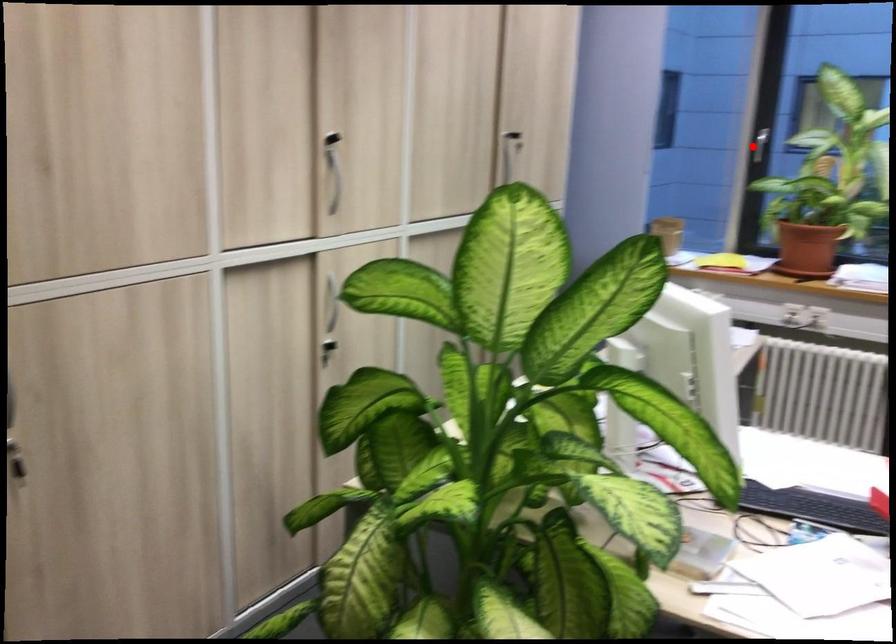
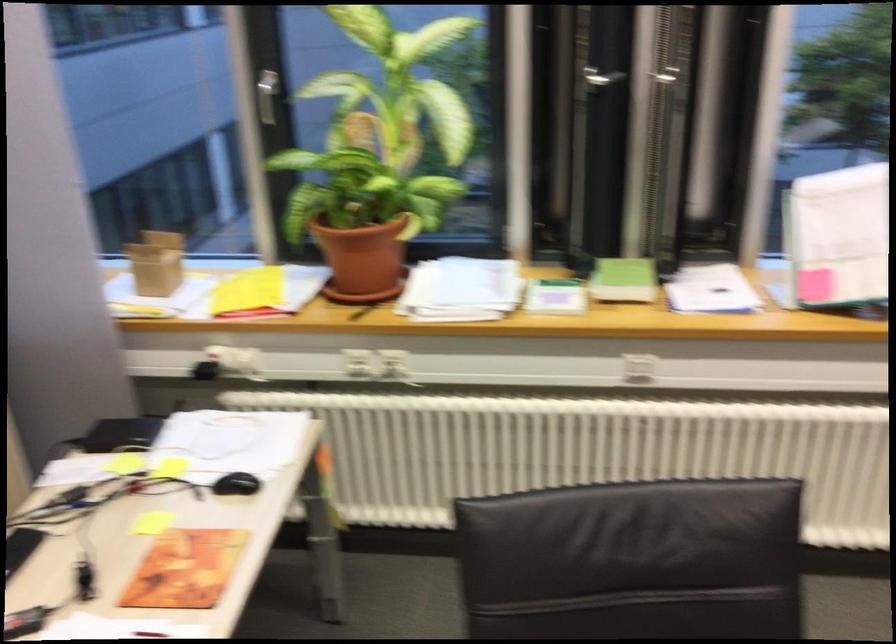
Question: I am providing you with two images of the same scene from different viewpoints. In image1, a red point is highlighted. Considering the same 3D point in image2, which of the following is correct?

Choices:
 (A) It is closer
 (B) It is farther

Answer: (A)